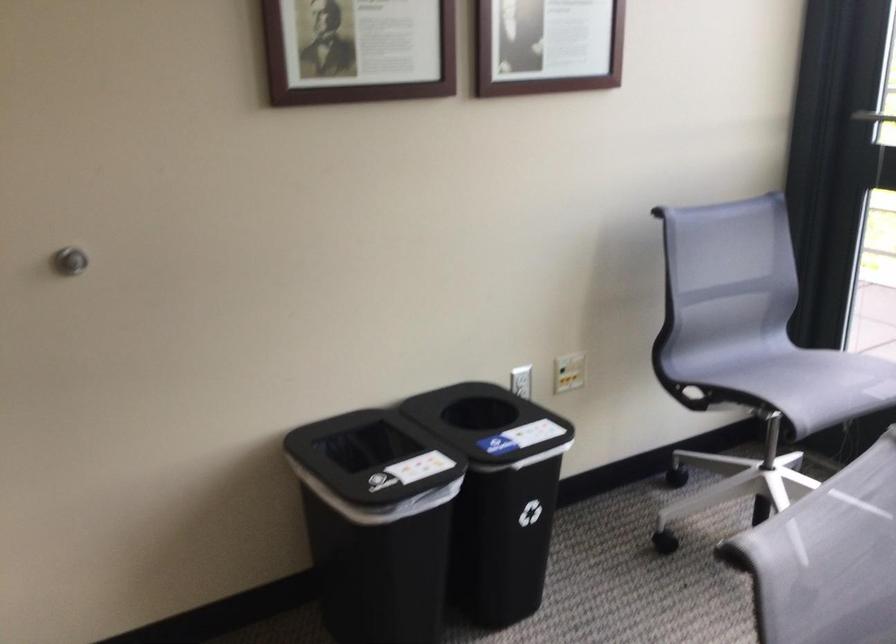
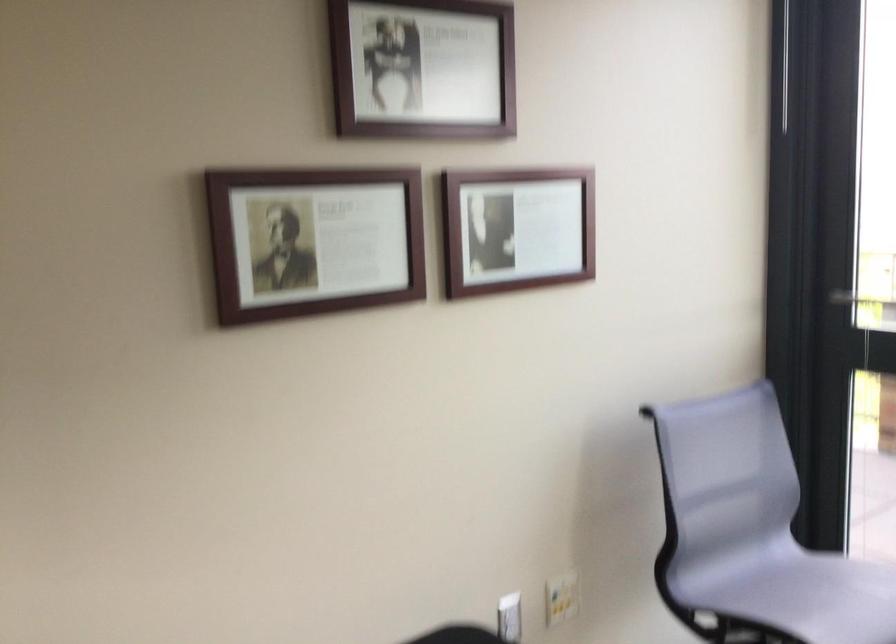
What movement of the cameraman would produce the second image?

The cameraman moved toward left, forward.